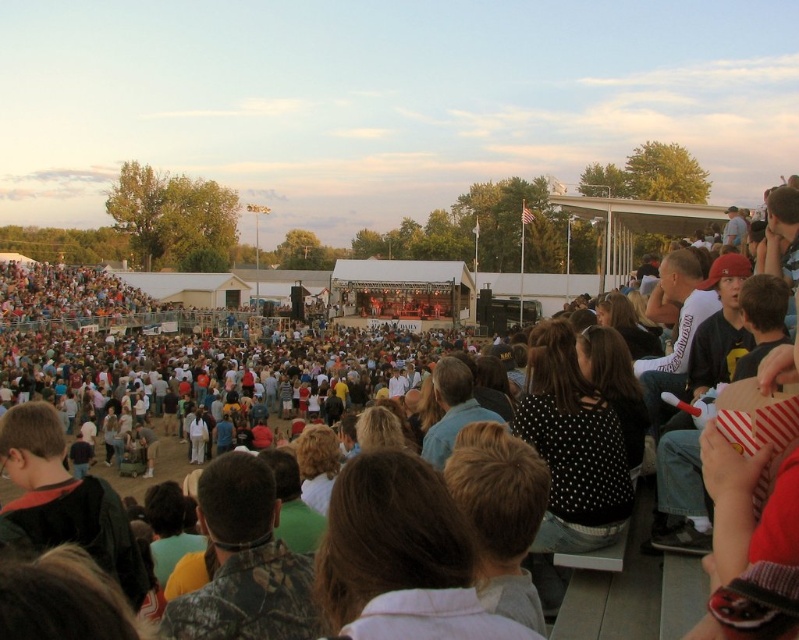
You are a photographer at the event and want to capture a photo of the camouflage shirt at center and dark brown hair at center. Which object is wider when viewed from your position?

The camouflage shirt at center is wider than the dark brown hair at center.

You are an event organizer trying to determine seating arrangements based on the image. Which of the two items, the camouflage shirt at center or the dark blue jacket at lower left, would require more space if placed on a rack?

The dark blue jacket at lower left requires more space because it occupies more space than the camouflage shirt at center.